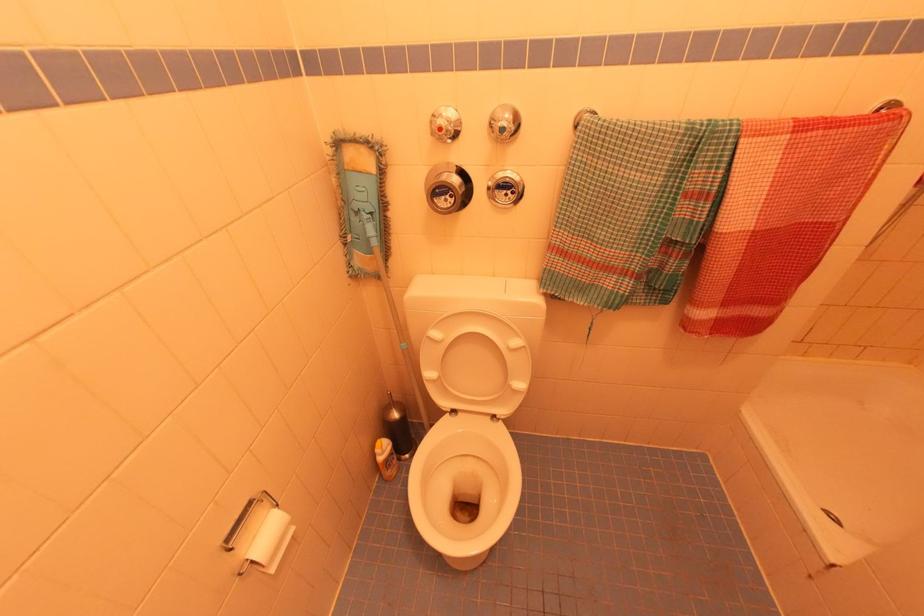
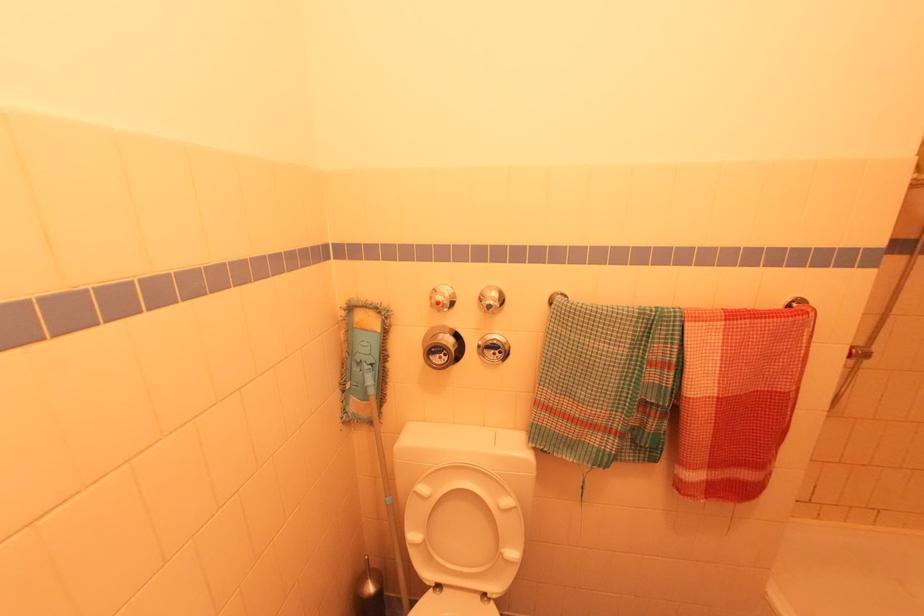
Question: How did the camera likely rotate?

Choices:
 (A) Left
 (B) Right
 (C) Up
 (D) Down

Answer: (C)